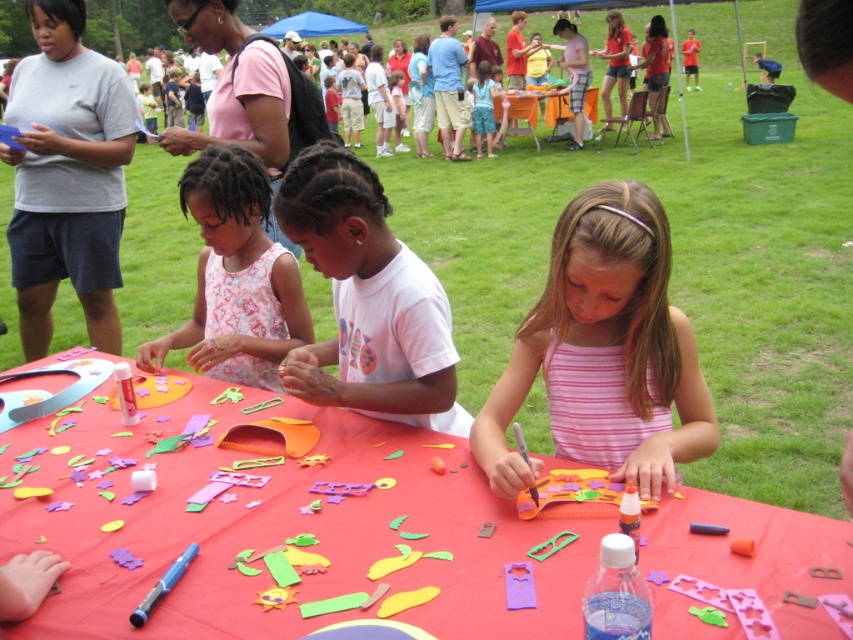
Question: Is red felt table at center to the right of floral fabric dress at center from the viewer's perspective?

Choices:
 (A) yes
 (B) no

Answer: (A)

Question: Can you confirm if red felt table at center is positioned below floral fabric dress at center?

Choices:
 (A) no
 (B) yes

Answer: (B)

Question: Is white cotton shirt at center smaller than floral fabric dress at center?

Choices:
 (A) no
 (B) yes

Answer: (B)

Question: Which of these objects is positioned closest to the floral fabric dress at center?

Choices:
 (A) pink striped tank top at center
 (B) white cotton shirt at center
 (C) red felt table at center

Answer: (B)

Question: Which of the following is the closest to the observer?

Choices:
 (A) (146, 552)
 (B) (247, 180)
 (C) (625, 344)

Answer: (A)

Question: Which of the following is the farthest from the observer?

Choices:
 (A) (663, 435)
 (B) (554, 561)

Answer: (A)